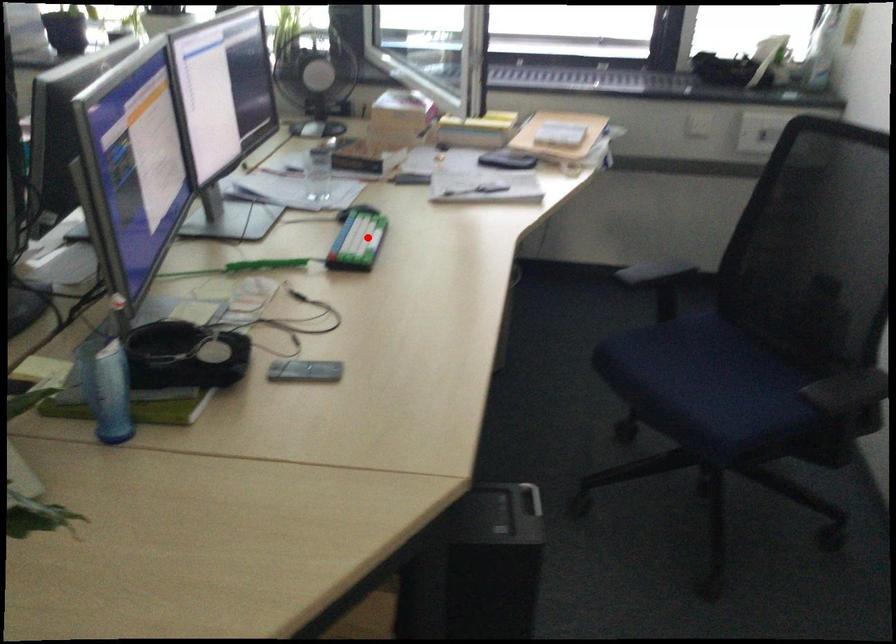
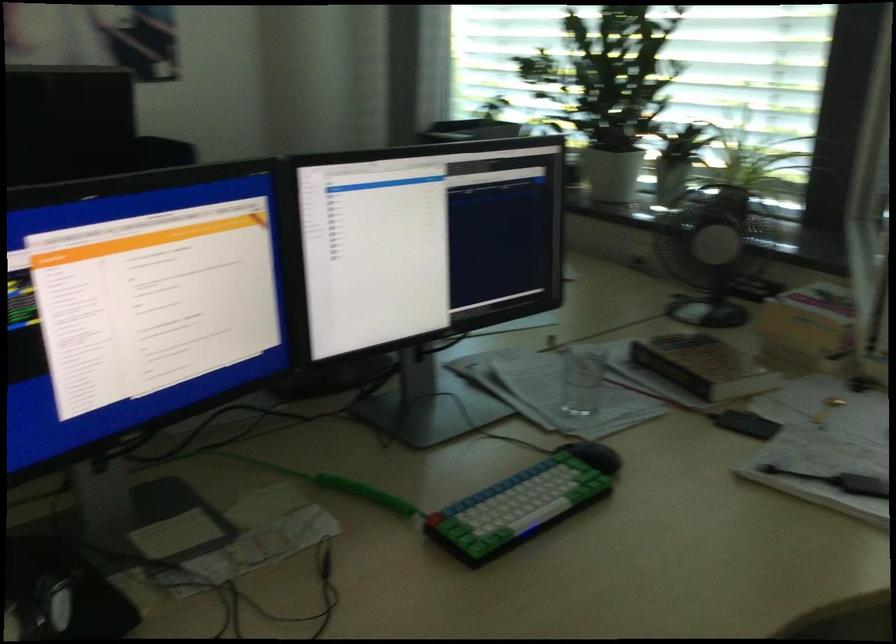
Find the pixel in the second image that matches the highlighted location in the first image.

(523, 503)